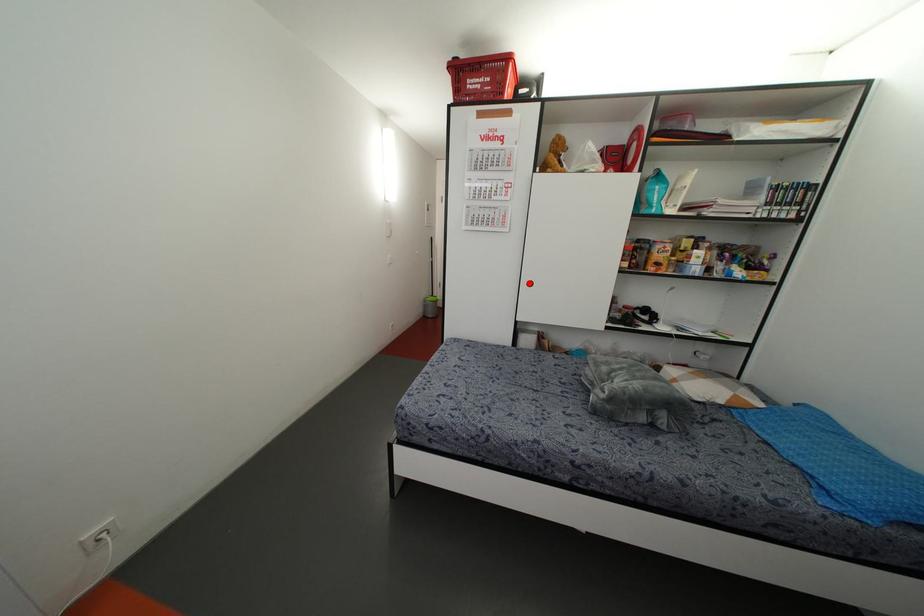
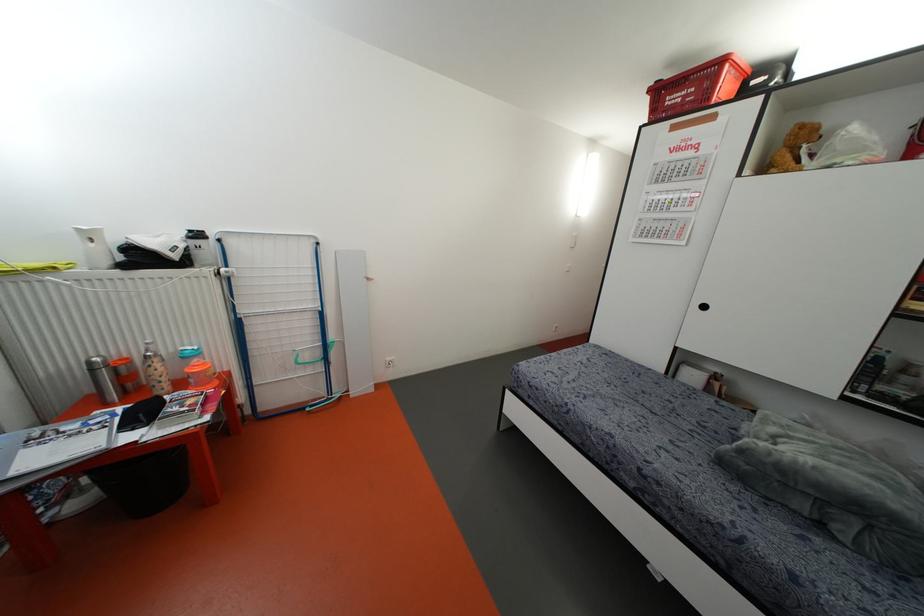
Locate, in the second image, the point that corresponds to the highlighted location in the first image.

(703, 307)